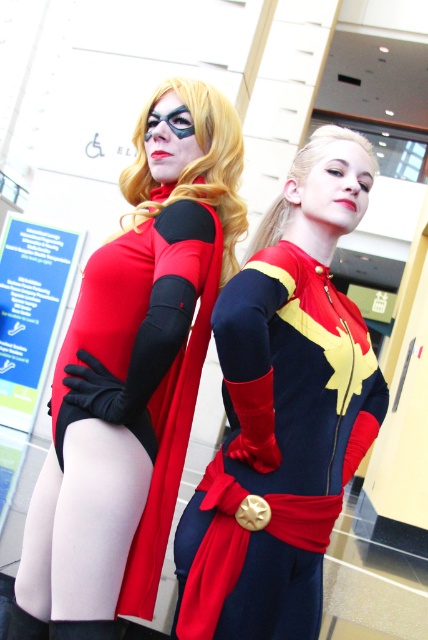
Does matte black bodysuit at left lie in front of matte red cape at center?

That is False.

Does matte black bodysuit at left appear on the right side of matte red cape at center?

In fact, matte black bodysuit at left is to the left of matte red cape at center.

Does point (74, 579) come behind point (235, 580)?

No.

The image size is (428, 640). Identify the location of matte black bodysuit at left. (133, 372).